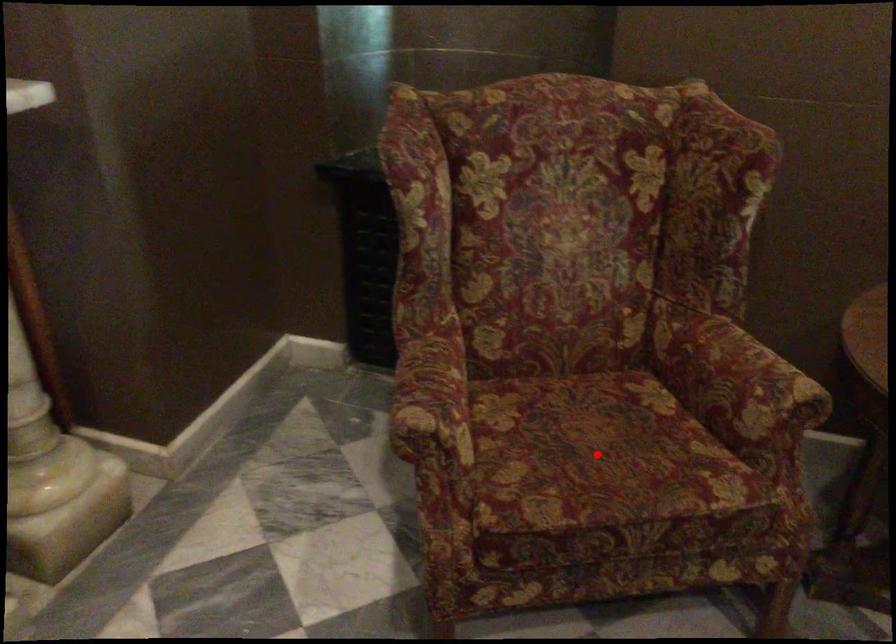
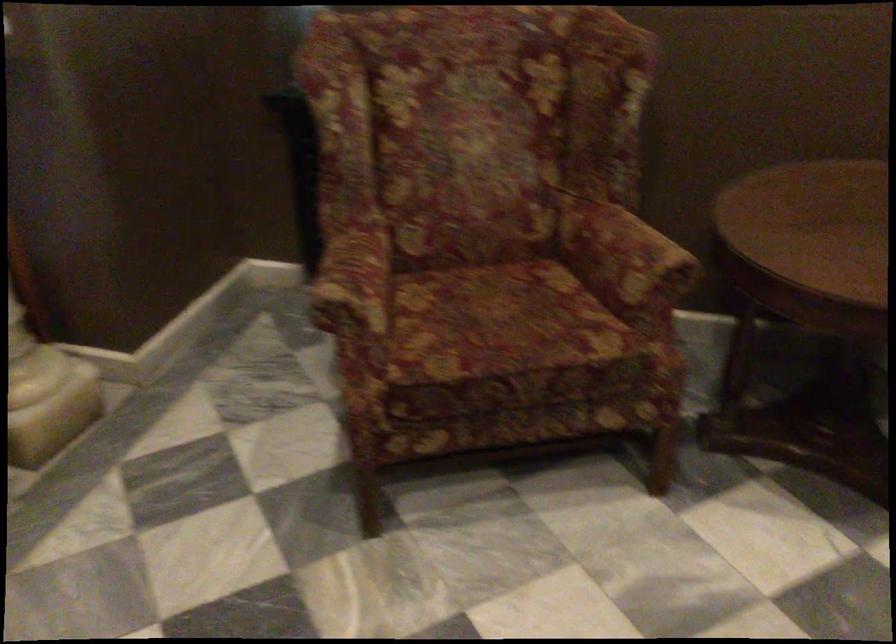
Find the pixel in the second image that matches the highlighted location in the first image.

(501, 323)